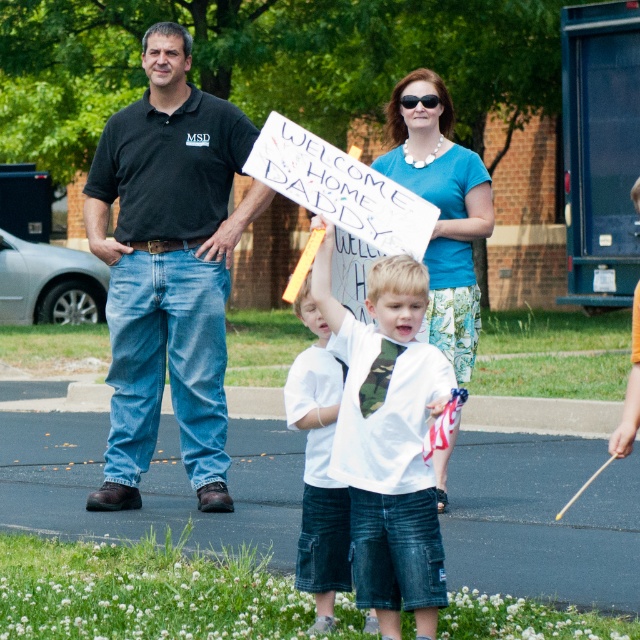
You are a photographer at the event and want to take a closeup photo of both the camouflage tie at center and the white cotton shirt at center. The camera has a focus range that can capture objects within 15 inches of each other. Will both items be in focus in the photo?

The camouflage tie at center and white cotton shirt at center are 17.28 inches apart, which is beyond the camera focus range of 15 inches. Therefore, both items cannot be in focus simultaneously in the photo.

From the picture: You are a photographer standing at a certain distance from the scene. You want to take a clear photo of the black cotton polo shirt at center. If your camera can focus on objects up to 10 meters away, will you be able to capture it clearly?

The black cotton polo shirt at center is 10.55 meters away from the camera. Since the camera can only focus up to 10 meters, it will not be able to capture the black cotton polo shirt at center clearly.